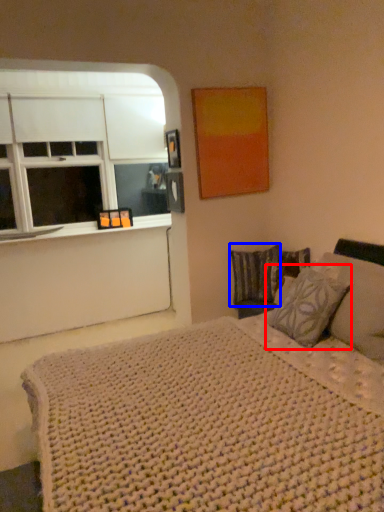
Question: Which object is closer to the camera taking this photo, pillow (highlighted by a red box) or pillow (highlighted by a blue box)?

Choices:
 (A) pillow
 (B) pillow

Answer: (A)